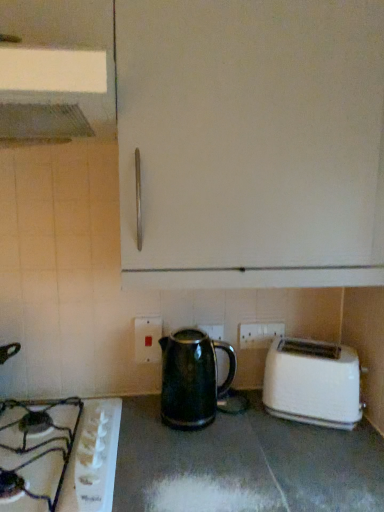
Question: From the image's perspective, is metallic silver exhaust hood at upper left on top of white plastic toaster at lower right?

Choices:
 (A) yes
 (B) no

Answer: (A)

Question: Is metallic silver exhaust hood at upper left turned away from white plastic toaster at lower right?

Choices:
 (A) no
 (B) yes

Answer: (A)

Question: Can you confirm if metallic silver exhaust hood at upper left is wider than white plastic toaster at lower right?

Choices:
 (A) no
 (B) yes

Answer: (B)

Question: Is metallic silver exhaust hood at upper left taller than white plastic toaster at lower right?

Choices:
 (A) no
 (B) yes

Answer: (A)

Question: Is metallic silver exhaust hood at upper left at the left side of white plastic toaster at lower right?

Choices:
 (A) no
 (B) yes

Answer: (B)

Question: Is metallic silver exhaust hood at upper left positioned before white plastic toaster at lower right?

Choices:
 (A) yes
 (B) no

Answer: (A)

Question: Is white plastic electric outlet at lower center, which is counted as the 2th electric outlet, starting from the right, at the right side of white plastic toaster at lower right?

Choices:
 (A) no
 (B) yes

Answer: (A)

Question: Is white plastic electric outlet at lower center, which is the 1th electric outlet in left-to-right order, placed right next to white plastic toaster at lower right?

Choices:
 (A) yes
 (B) no

Answer: (B)

Question: Considering the relative sizes of white plastic electric outlet at lower center, which is the 1th electric outlet in left-to-right order, and white plastic toaster at lower right in the image provided, is white plastic electric outlet at lower center, which is the 1th electric outlet in left-to-right order, shorter than white plastic toaster at lower right?

Choices:
 (A) yes
 (B) no

Answer: (A)

Question: From a real-world perspective, is white plastic electric outlet at lower center, which is the second electric outlet from back to front, positioned under white plastic toaster at lower right based on gravity?

Choices:
 (A) yes
 (B) no

Answer: (B)

Question: Does white plastic electric outlet at lower center, which is the second electric outlet from back to front, have a lesser width compared to white plastic toaster at lower right?

Choices:
 (A) yes
 (B) no

Answer: (A)

Question: From the image's perspective, is white plastic electric outlet at lower center, which is counted as the 2th electric outlet, starting from the right, below white plastic toaster at lower right?

Choices:
 (A) yes
 (B) no

Answer: (B)

Question: Is green glossy kettle at center positioned before white plastic electric outlet at lower center, which is counted as the 2th electric outlet, starting from the right?

Choices:
 (A) yes
 (B) no

Answer: (A)